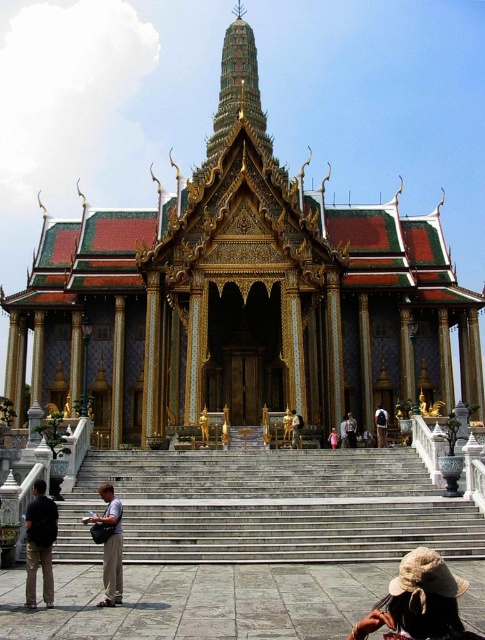
Does golden statue at center have a lesser width compared to pink fabric dress at center?

Indeed, golden statue at center has a lesser width compared to pink fabric dress at center.

Which of these two, golden statue at center or pink fabric dress at center, stands shorter?

With less height is pink fabric dress at center.

Who is more forward, [298,445] or [329,444]?

Point [298,445]

Locate an element on the screen. Image resolution: width=485 pixels, height=640 pixels. golden statue at center is located at coordinates (295, 428).

Can you confirm if white marble stairs at center is bigger than pink fabric dress at center?

Yes.

Which is more to the right, white marble stairs at center or pink fabric dress at center?

Positioned to the right is pink fabric dress at center.

Between point (373, 497) and point (336, 428), which one is positioned in front?

Point (373, 497) is more forward.

At what (x,y) coordinates should I click in order to perform the action: click on white marble stairs at center. Please return your answer as a coordinate pair (x, y). This screenshot has height=640, width=485. Looking at the image, I should click on (269, 506).

Who is more forward, [44,547] or [205,428]?

Point [44,547] is more forward.

Does black cotton shirt at lower left appear under gold metallic statue at center?

Correct, black cotton shirt at lower left is located below gold metallic statue at center.

Which is behind, point (38, 481) or point (209, 417)?

The point (209, 417) is more distant.

Where is `black cotton shirt at lower left`? This screenshot has height=640, width=485. black cotton shirt at lower left is located at coordinates (39, 544).